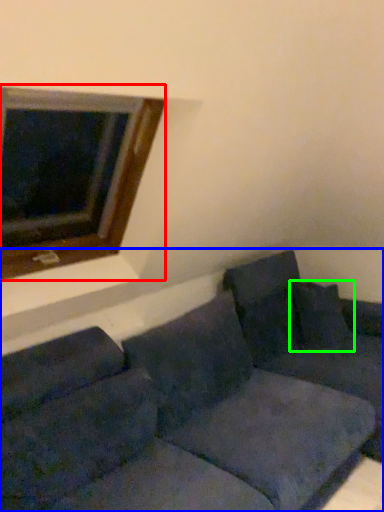
Question: Which object is the closest to the window (highlighted by a red box)? Choose among these: studio couch (highlighted by a blue box) or pillow (highlighted by a green box).

Choices:
 (A) studio couch
 (B) pillow

Answer: (A)